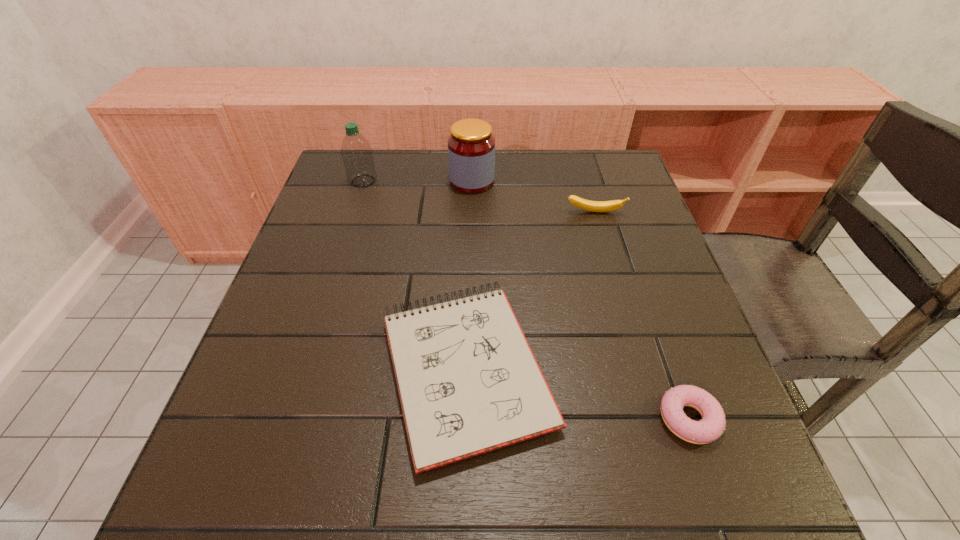
Locate an element on the screen. vacant space at the right edge of the desktop is located at coordinates (691, 310).

The width and height of the screenshot is (960, 540). In the image, there is a desktop. What are the coordinates of `vacant space at the far right corner` in the screenshot? It's located at (608, 192).

What are the coordinates of `empty location between the doughnut and the leftmost object` in the screenshot? It's located at (526, 300).

The width and height of the screenshot is (960, 540). I want to click on vacant space that's between the third shortest object and the jar, so click(x=534, y=197).

The image size is (960, 540). I want to click on vacant area that lies between the doughnut and the notepad, so click(578, 394).

The image size is (960, 540). I want to click on vacant area that lies between the third farthest object and the water bottle, so click(x=479, y=197).

Locate an element on the screen. The width and height of the screenshot is (960, 540). free space between the leftmost object and the doughnut is located at coordinates (526, 300).

Find the location of a particular element. This screenshot has height=540, width=960. free spot between the doughnut and the leftmost object is located at coordinates (526, 300).

Where is `free space between the banana and the notepad`? This screenshot has height=540, width=960. free space between the banana and the notepad is located at coordinates (531, 291).

The width and height of the screenshot is (960, 540). Find the location of `vacant space that's between the water bottle and the jar`. vacant space that's between the water bottle and the jar is located at coordinates (418, 181).